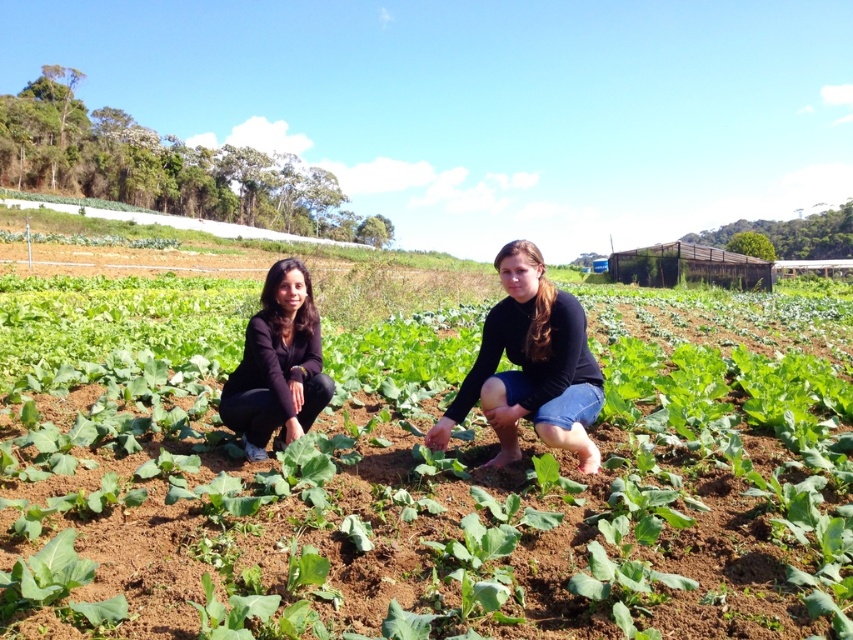
Question: Which point is farther to the camera?

Choices:
 (A) [480, 349]
 (B) [691, 515]

Answer: (A)

Question: From the image, what is the correct spatial relationship of black matte jeans at center in relation to black matte jacket at center?

Choices:
 (A) left
 (B) right

Answer: (B)

Question: Which object appears farthest from the camera in this image?

Choices:
 (A) green leafy plant at center
 (B) black matte jeans at center

Answer: (B)

Question: Which point is closer to the camera?

Choices:
 (A) (436, 465)
 (B) (241, 396)
 (C) (503, 324)

Answer: (A)

Question: Where is green leafy plant at center located in relation to black matte jeans at center in the image?

Choices:
 (A) below
 (B) above

Answer: (B)

Question: Does green leafy plant at center have a larger size compared to black matte jacket at center?

Choices:
 (A) no
 (B) yes

Answer: (B)